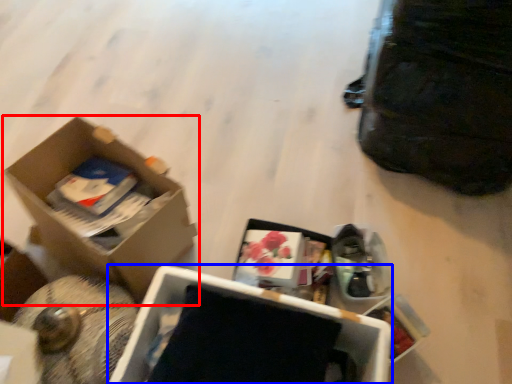
Question: Which object appears closest to the camera in this image, box (highlighted by a red box) or box (highlighted by a blue box)?

Choices:
 (A) box
 (B) box

Answer: (B)